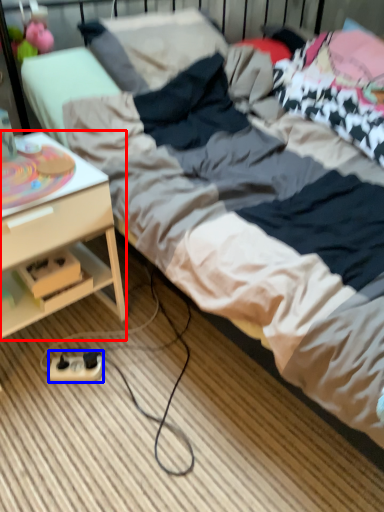
Question: Which point is closer to the camera, desk (highlighted by a red box) or extension cord (highlighted by a blue box)?

Choices:
 (A) desk
 (B) extension cord

Answer: (A)